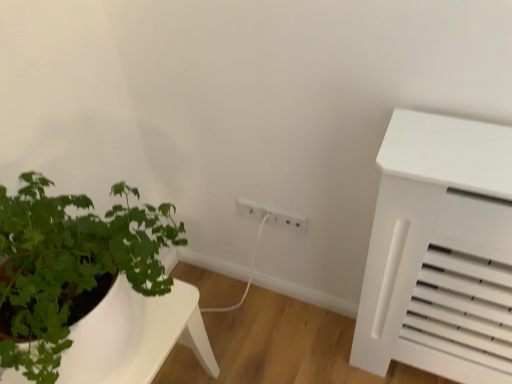
Identify the location of white plastic electric outlet at center, which appears as the 2th electric outlet when viewed from the right. (270, 217).

This screenshot has width=512, height=384. Describe the element at coordinates (135, 336) in the screenshot. I see `white matte table at lower left` at that location.

What is the approximate height of white matte table at lower left?

The height of white matte table at lower left is 18.22 inches.

Find the location of a particular element. The height and width of the screenshot is (384, 512). white plastic electric outlet at center, placed as the first electric outlet when sorted from right to left is located at coordinates coord(271,216).

Where is `table on the right of green leafy plant at left`? The image size is (512, 384). table on the right of green leafy plant at left is located at coordinates (135, 336).

From the image's perspective, is green leafy plant at left above white matte table at lower left?

Indeed, from the image's perspective, green leafy plant at left is shown above white matte table at lower left.

Based on the photo, how many degrees apart are the facing directions of green leafy plant at left and white matte table at lower left?

They differ by 1.05 degrees in their facing directions.

Is the surface of green leafy plant at left in direct contact with white matte table at lower left?

No, green leafy plant at left is not with white matte table at lower left.

How distant is white plastic electric outlet at center, which appears as the 2th electric outlet when viewed from the right, from white matte table at lower left?

21.13 inches.

Can you confirm if white plastic electric outlet at center, which appears as the 1th electric outlet when viewed from the left, is bigger than white matte table at lower left?

Incorrect, white plastic electric outlet at center, which appears as the 1th electric outlet when viewed from the left, is not larger than white matte table at lower left.

Is point (274, 221) farther from camera compared to point (124, 348)?

That is True.

What's the angular difference between white matte table at lower left and white plastic electric outlet at center, which appears as the 1th electric outlet when viewed from the left,'s facing directions?

There is a 88.7-degree angle between the facing directions of white matte table at lower left and white plastic electric outlet at center, which appears as the 1th electric outlet when viewed from the left.

Is white matte table at lower left bigger than white plastic electric outlet at center, which appears as the 2th electric outlet when viewed from the right?

Yes.

Is white matte table at lower left at the right side of white plastic electric outlet at center, which appears as the 1th electric outlet when viewed from the left?

No.

Is white matte table at lower left taller or shorter than white plastic electric outlet at center, which appears as the 1th electric outlet when viewed from the left?

Clearly, white matte table at lower left is taller compared to white plastic electric outlet at center, which appears as the 1th electric outlet when viewed from the left.

Considering the sizes of objects white plastic electric outlet at center, which appears as the 2th electric outlet when viewed from the right, and white plastic electric outlet at center, acting as the 2th electric outlet starting from the left, in the image provided, who is wider, white plastic electric outlet at center, which appears as the 2th electric outlet when viewed from the right, or white plastic electric outlet at center, acting as the 2th electric outlet starting from the left,?

Wider between the two is white plastic electric outlet at center, acting as the 2th electric outlet starting from the left.

Is point (271, 222) farther from viewer compared to point (269, 213)?

Yes.

Is white plastic electric outlet at center, which appears as the 2th electric outlet when viewed from the right, turned away from white plastic electric outlet at center, acting as the 2th electric outlet starting from the left?

Yes.

From a real-world perspective, does white plastic electric outlet at center, which appears as the 1th electric outlet when viewed from the left, stand above white plastic electric outlet at center, placed as the first electric outlet when sorted from right to left?

Yes, from a real-world perspective, white plastic electric outlet at center, which appears as the 1th electric outlet when viewed from the left, is over white plastic electric outlet at center, placed as the first electric outlet when sorted from right to left

Which object is wider, white plastic electric outlet at center, placed as the first electric outlet when sorted from right to left, or green leafy plant at left?

Wider between the two is green leafy plant at left.

Between white plastic electric outlet at center, placed as the first electric outlet when sorted from right to left, and green leafy plant at left, which one is positioned in front?

green leafy plant at left is in front.

Which object is positioned more to the right, white plastic electric outlet at center, acting as the 2th electric outlet starting from the left, or green leafy plant at left?

white plastic electric outlet at center, acting as the 2th electric outlet starting from the left, is more to the right.

From the image's perspective, which is below, white matte table at lower left or white plastic electric outlet at center, acting as the 2th electric outlet starting from the left?

white matte table at lower left appears lower in the image.

Considering the relative sizes of white matte table at lower left and white plastic electric outlet at center, acting as the 2th electric outlet starting from the left, in the image provided, is white matte table at lower left smaller than white plastic electric outlet at center, acting as the 2th electric outlet starting from the left,?

No.

Which object is more forward, white matte table at lower left or white plastic electric outlet at center, acting as the 2th electric outlet starting from the left?

white matte table at lower left is in front.

Can you confirm if white matte table at lower left is taller than white plastic electric outlet at center, placed as the first electric outlet when sorted from right to left?

Correct, white matte table at lower left is much taller as white plastic electric outlet at center, placed as the first electric outlet when sorted from right to left.

From a real-world perspective, who is located higher, white plastic electric outlet at center, placed as the first electric outlet when sorted from right to left, or white plastic electric outlet at center, which appears as the 2th electric outlet when viewed from the right?

white plastic electric outlet at center, which appears as the 2th electric outlet when viewed from the right, is physically above.

Is point (282, 212) farther from viewer compared to point (269, 216)?

That is False.

Can we say white plastic electric outlet at center, acting as the 2th electric outlet starting from the left, lies outside white plastic electric outlet at center, which appears as the 2th electric outlet when viewed from the right?

white plastic electric outlet at center, acting as the 2th electric outlet starting from the left, lies outside white plastic electric outlet at center, which appears as the 2th electric outlet when viewed from the right,'s area.

This screenshot has width=512, height=384. In order to click on table below the green leafy plant at left (from the image's perspective) in this screenshot , I will do `click(135, 336)`.

The height and width of the screenshot is (384, 512). I want to click on table beneath the white plastic electric outlet at center, which appears as the 2th electric outlet when viewed from the right (from a real-world perspective), so click(x=135, y=336).

Which object lies further to the anchor point white matte table at lower left, white plastic electric outlet at center, which appears as the 2th electric outlet when viewed from the right, or green leafy plant at left?

Based on the image, white plastic electric outlet at center, which appears as the 2th electric outlet when viewed from the right, appears to be further to white matte table at lower left.

Considering their positions, is white matte table at lower left positioned closer to green leafy plant at left than white plastic electric outlet at center, placed as the first electric outlet when sorted from right to left?

white matte table at lower left lies closer to green leafy plant at left than the other object.

From the image, which object appears to be farther from white plastic electric outlet at center, which appears as the 1th electric outlet when viewed from the left, white matte table at lower left or green leafy plant at left?

The object further to white plastic electric outlet at center, which appears as the 1th electric outlet when viewed from the left, is green leafy plant at left.

Which object lies further to the anchor point white plastic electric outlet at center, acting as the 2th electric outlet starting from the left, green leafy plant at left or white matte table at lower left?

Based on the image, green leafy plant at left appears to be further to white plastic electric outlet at center, acting as the 2th electric outlet starting from the left.

From the image, which object appears to be farther from white matte table at lower left, green leafy plant at left or white plastic electric outlet at center, placed as the first electric outlet when sorted from right to left?

The object further to white matte table at lower left is white plastic electric outlet at center, placed as the first electric outlet when sorted from right to left.

Based on their spatial positions, is white plastic electric outlet at center, placed as the first electric outlet when sorted from right to left, or green leafy plant at left further from white plastic electric outlet at center, which appears as the 2th electric outlet when viewed from the right?

green leafy plant at left is positioned further to the anchor white plastic electric outlet at center, which appears as the 2th electric outlet when viewed from the right.

Consider the image. When comparing their distances from green leafy plant at left, does white plastic electric outlet at center, placed as the first electric outlet when sorted from right to left, or white matte table at lower left seem further?

white plastic electric outlet at center, placed as the first electric outlet when sorted from right to left, is positioned further to the anchor green leafy plant at left.

Looking at the image, which one is located closer to white plastic electric outlet at center, which appears as the 1th electric outlet when viewed from the left, white plastic electric outlet at center, placed as the first electric outlet when sorted from right to left, or white matte table at lower left?

white plastic electric outlet at center, placed as the first electric outlet when sorted from right to left, is positioned closer to the anchor white plastic electric outlet at center, which appears as the 1th electric outlet when viewed from the left.

Identify the location of electric outlet positioned between green leafy plant at left and white plastic electric outlet at center, which appears as the 2th electric outlet when viewed from the right, from near to far. (271, 216).

Where is `electric outlet between white matte table at lower left and white plastic electric outlet at center, which appears as the 2th electric outlet when viewed from the right, along the z-axis`? Image resolution: width=512 pixels, height=384 pixels. electric outlet between white matte table at lower left and white plastic electric outlet at center, which appears as the 2th electric outlet when viewed from the right, along the z-axis is located at coordinates (271, 216).

You are a GUI agent. You are given a task and a screenshot of the screen. Output one action in this format:
    pyautogui.click(x=<x>, y=<y>)
    Task: Click on the table between green leafy plant at left and white plastic electric outlet at center, which appears as the 1th electric outlet when viewed from the left, along the z-axis
    Image resolution: width=512 pixels, height=384 pixels.
    Given the screenshot: What is the action you would take?
    pyautogui.click(x=135, y=336)

Locate an element on the screen. Image resolution: width=512 pixels, height=384 pixels. table positioned between green leafy plant at left and white plastic electric outlet at center, acting as the 2th electric outlet starting from the left, from near to far is located at coordinates click(135, 336).